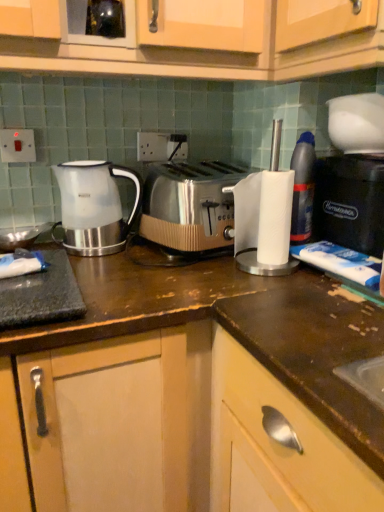
Question: From the image's perspective, is black plastic coffee machine at right above or below translucent plastic bottle at right?

Choices:
 (A) below
 (B) above

Answer: (A)

Question: From a real-world perspective, is black plastic coffee machine at right above or below translucent plastic bottle at right?

Choices:
 (A) above
 (B) below

Answer: (B)

Question: Which is nearer to the satin silver toaster at center?

Choices:
 (A) black plastic coffee machine at right
 (B) white plastic electric outlet at upper left, the 1th electric outlet in the front-to-back sequence
 (C) white glossy kettle at left
 (D) translucent plastic bottle at right
 (E) white plastic electric outlet at center, acting as the second electric outlet starting from the front

Answer: (C)

Question: Estimate the real-world distances between objects in this image. Which object is closer to the black plastic coffee machine at right?

Choices:
 (A) white glossy kettle at left
 (B) translucent plastic bottle at right
 (C) satin silver toaster at center
 (D) white plastic electric outlet at upper left, which is the second electric outlet in right-to-left order
 (E) white plastic electric outlet at center, acting as the second electric outlet starting from the front

Answer: (B)